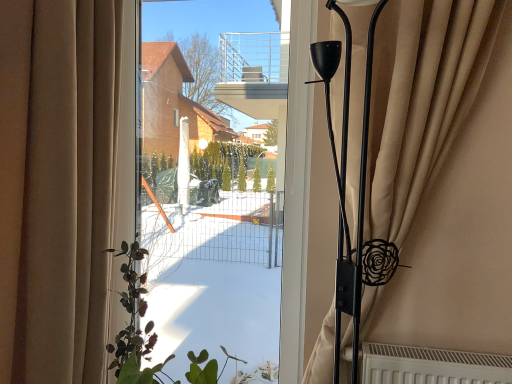
What do you see at coordinates (132, 317) in the screenshot?
I see `green matte plant at left` at bounding box center [132, 317].

Describe the element at coordinates (215, 274) in the screenshot. I see `transparent glass window screen at center` at that location.

Describe the element at coordinates (435, 165) in the screenshot. I see `beige fabric curtain at right, placed as the first curtain when sorted from right to left` at that location.

Image resolution: width=512 pixels, height=384 pixels. Find the location of `green matte plant at left`. green matte plant at left is located at coordinates (132, 317).

Consider the image. Does beige fabric curtain at right, which appears as the second curtain when viewed from the left, appear on the right side of transparent glass window screen at center?

Indeed, beige fabric curtain at right, which appears as the second curtain when viewed from the left, is positioned on the right side of transparent glass window screen at center.

At what (x,y) coordinates should I click in order to perform the action: click on the 2nd curtain positioned below the transparent glass window screen at center (from the image's perspective). Please return your answer as a coordinate pair (x, y). This screenshot has width=512, height=384. Looking at the image, I should click on (435, 165).

In the scene shown: Can you tell me how much beige fabric curtain at right, placed as the first curtain when sorted from right to left, and transparent glass window screen at center differ in facing direction?

There is a 3.63-degree angle between the facing directions of beige fabric curtain at right, placed as the first curtain when sorted from right to left, and transparent glass window screen at center.

Could you tell me if beige fabric curtain at right, which appears as the second curtain when viewed from the left, is facing transparent glass window screen at center?

No.

Which is in front, point (115, 364) or point (372, 336)?

Positioned in front is point (115, 364).

I want to click on plant below the beige fabric curtain at right, placed as the first curtain when sorted from right to left (from a real-world perspective), so click(x=132, y=317).

Would you say green matte plant at left is to the left or to the right of beige fabric curtain at right, which appears as the second curtain when viewed from the left, in the picture?

Clearly, green matte plant at left is on the left of beige fabric curtain at right, which appears as the second curtain when viewed from the left, in the image.

Is green matte plant at left with beige fabric curtain at right, which appears as the second curtain when viewed from the left?

They are not placed beside each other.

Locate an element on the screen. The width and height of the screenshot is (512, 384). curtain above the beige fabric curtain at right, which appears as the second curtain when viewed from the left (from the image's perspective) is located at coordinates (56, 185).

From their relative heights in the image, would you say beige fabric curtain at right, placed as the first curtain when sorted from right to left, is taller or shorter than beige fabric curtain at left, marked as the 2th curtain in a right-to-left arrangement?

Considering their sizes, beige fabric curtain at right, placed as the first curtain when sorted from right to left, has more height than beige fabric curtain at left, marked as the 2th curtain in a right-to-left arrangement.

From the picture: From a real-world perspective, is beige fabric curtain at right, placed as the first curtain when sorted from right to left, positioned above or below beige fabric curtain at left, acting as the 1th curtain starting from the left?

From a real-world perspective, beige fabric curtain at right, placed as the first curtain when sorted from right to left, is physically above beige fabric curtain at left, acting as the 1th curtain starting from the left.

Looking at this image, is beige fabric curtain at left, marked as the 2th curtain in a right-to-left arrangement, inside green matte plant at left?

That's incorrect, beige fabric curtain at left, marked as the 2th curtain in a right-to-left arrangement, is not inside green matte plant at left.

Which object is further away from the camera taking this photo, green matte plant at left or beige fabric curtain at left, acting as the 1th curtain starting from the left?

green matte plant at left.

What's the angular difference between green matte plant at left and beige fabric curtain at left, acting as the 1th curtain starting from the left,'s facing directions?

The angular difference between green matte plant at left and beige fabric curtain at left, acting as the 1th curtain starting from the left, is 90.9 degrees.

Does green matte plant at left touch beige fabric curtain at left, marked as the 2th curtain in a right-to-left arrangement?

They are not placed beside each other.

Which of these two, beige fabric curtain at left, acting as the 1th curtain starting from the left, or transparent glass window screen at center, is smaller?

With smaller size is transparent glass window screen at center.

Considering the relative sizes of beige fabric curtain at left, acting as the 1th curtain starting from the left, and transparent glass window screen at center in the image provided, is beige fabric curtain at left, acting as the 1th curtain starting from the left, shorter than transparent glass window screen at center?

Yes, beige fabric curtain at left, acting as the 1th curtain starting from the left, is shorter than transparent glass window screen at center.

Locate an element on the screen. The image size is (512, 384). window screen above the beige fabric curtain at left, acting as the 1th curtain starting from the left (from the image's perspective) is located at coordinates (215, 274).

From the image's perspective, is beige fabric curtain at left, marked as the 2th curtain in a right-to-left arrangement, beneath transparent glass window screen at center?

Yes, from the image's perspective, beige fabric curtain at left, marked as the 2th curtain in a right-to-left arrangement, is beneath transparent glass window screen at center.

You are a GUI agent. You are given a task and a screenshot of the screen. Output one action in this format:
    pyautogui.click(x=<x>, y=<y>)
    Task: Click on the window screen lying behind the beige fabric curtain at right, which appears as the second curtain when viewed from the left
    The height and width of the screenshot is (384, 512).
    Given the screenshot: What is the action you would take?
    pyautogui.click(x=215, y=274)

Is transparent glass window screen at center oriented towards beige fabric curtain at right, which appears as the second curtain when viewed from the left?

No, transparent glass window screen at center is not facing towards beige fabric curtain at right, which appears as the second curtain when viewed from the left.

Which is more distant, (227, 347) or (410, 130)?

Point (227, 347)

Measure the distance from transparent glass window screen at center to green matte plant at left.

transparent glass window screen at center and green matte plant at left are 25.00 inches apart.

Considering the relative sizes of transparent glass window screen at center and green matte plant at left in the image provided, is transparent glass window screen at center thinner than green matte plant at left?

Yes, transparent glass window screen at center is thinner than green matte plant at left.

In the image, is transparent glass window screen at center on the left side or the right side of green matte plant at left?

From the image, it's evident that transparent glass window screen at center is to the right of green matte plant at left.

From the image's perspective, which is above, transparent glass window screen at center or green matte plant at left?

transparent glass window screen at center appears higher in the image.

Image resolution: width=512 pixels, height=384 pixels. What are the coordinates of `curtain that is on the right side of transparent glass window screen at center` in the screenshot? It's located at (435, 165).

From the image's perspective, which curtain is the 1st one above the green matte plant at left? Please provide its 2D coordinates.

[(435, 165)]

Which object lies further to the anchor point beige fabric curtain at right, placed as the first curtain when sorted from right to left, beige fabric curtain at left, acting as the 1th curtain starting from the left, or transparent glass window screen at center?

transparent glass window screen at center lies further to beige fabric curtain at right, placed as the first curtain when sorted from right to left, than the other object.

From the image, which object appears to be farther from beige fabric curtain at left, marked as the 2th curtain in a right-to-left arrangement, beige fabric curtain at right, which appears as the second curtain when viewed from the left, or transparent glass window screen at center?

beige fabric curtain at right, which appears as the second curtain when viewed from the left.

Looking at this image, estimate the real-world distances between objects in this image. Which object is closer to transparent glass window screen at center, beige fabric curtain at left, marked as the 2th curtain in a right-to-left arrangement, or beige fabric curtain at right, which appears as the second curtain when viewed from the left?

beige fabric curtain at left, marked as the 2th curtain in a right-to-left arrangement, is closer to transparent glass window screen at center.

When comparing their distances from green matte plant at left, does beige fabric curtain at right, which appears as the second curtain when viewed from the left, or beige fabric curtain at left, acting as the 1th curtain starting from the left, seem further?

Based on the image, beige fabric curtain at right, which appears as the second curtain when viewed from the left, appears to be further to green matte plant at left.

When comparing their distances from beige fabric curtain at left, acting as the 1th curtain starting from the left, does beige fabric curtain at right, placed as the first curtain when sorted from right to left, or green matte plant at left seem closer?

Among the two, green matte plant at left is located nearer to beige fabric curtain at left, acting as the 1th curtain starting from the left.

Considering their positions, is green matte plant at left positioned further to transparent glass window screen at center than beige fabric curtain at left, marked as the 2th curtain in a right-to-left arrangement?

beige fabric curtain at left, marked as the 2th curtain in a right-to-left arrangement, is further to transparent glass window screen at center.

Consider the image. Based on their spatial positions, is green matte plant at left or beige fabric curtain at right, which appears as the second curtain when viewed from the left, further from beige fabric curtain at left, marked as the 2th curtain in a right-to-left arrangement?

beige fabric curtain at right, which appears as the second curtain when viewed from the left, lies further to beige fabric curtain at left, marked as the 2th curtain in a right-to-left arrangement, than the other object.

From the image, which object appears to be farther from green matte plant at left, transparent glass window screen at center or beige fabric curtain at left, acting as the 1th curtain starting from the left?

transparent glass window screen at center lies further to green matte plant at left than the other object.

At what (x,y) coordinates should I click in order to perform the action: click on window screen located between beige fabric curtain at left, marked as the 2th curtain in a right-to-left arrangement, and beige fabric curtain at right, which appears as the second curtain when viewed from the left, in the left-right direction. Please return your answer as a coordinate pair (x, y). This screenshot has width=512, height=384. Looking at the image, I should click on (215, 274).

You are a GUI agent. You are given a task and a screenshot of the screen. Output one action in this format:
    pyautogui.click(x=<x>, y=<y>)
    Task: Click on the window screen situated between green matte plant at left and beige fabric curtain at right, which appears as the second curtain when viewed from the left, from left to right
    Image resolution: width=512 pixels, height=384 pixels.
    Given the screenshot: What is the action you would take?
    pyautogui.click(x=215, y=274)

Find the location of a particular element. The image size is (512, 384). plant between beige fabric curtain at left, marked as the 2th curtain in a right-to-left arrangement, and beige fabric curtain at right, which appears as the second curtain when viewed from the left, in the horizontal direction is located at coordinates (132, 317).

Locate an element on the screen. This screenshot has width=512, height=384. plant located between beige fabric curtain at left, acting as the 1th curtain starting from the left, and transparent glass window screen at center in the depth direction is located at coordinates (132, 317).